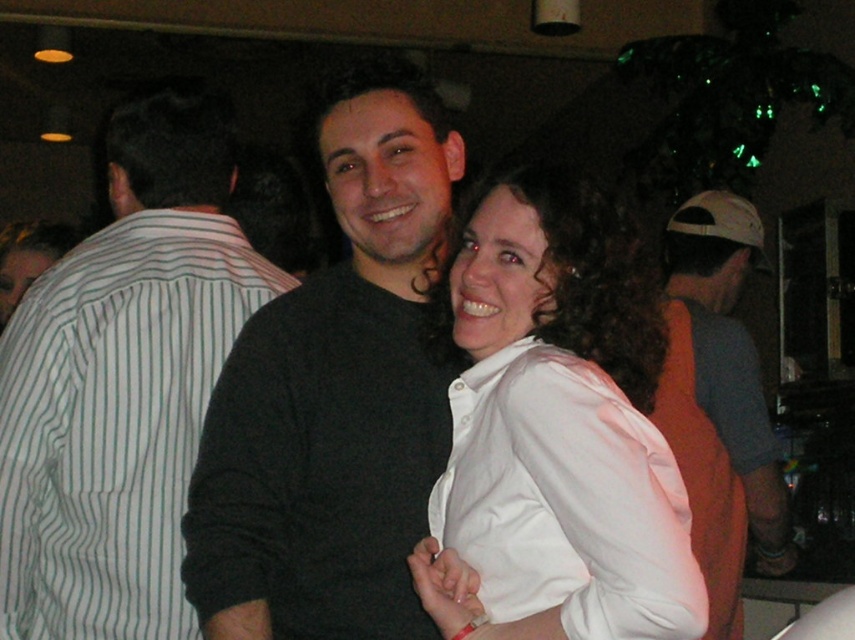
Question: Which point is farther from the camera taking this photo?

Choices:
 (A) (68, 596)
 (B) (735, 627)
 (C) (209, 524)
 (D) (655, 518)

Answer: (B)

Question: Does black matte sweater at center have a greater width compared to gray cotton shirt at right?

Choices:
 (A) yes
 (B) no

Answer: (B)

Question: Which is farther from the white satin blouse at center?

Choices:
 (A) gray cotton shirt at right
 (B) black matte sweater at center

Answer: (A)

Question: Is the position of white striped shirt at left more distant than that of white satin blouse at center?

Choices:
 (A) yes
 (B) no

Answer: (A)

Question: Based on their relative distances, which object is nearer to the black matte sweater at center?

Choices:
 (A) white satin blouse at center
 (B) white striped shirt at left

Answer: (A)

Question: Does black matte sweater at center appear under white satin blouse at center?

Choices:
 (A) no
 (B) yes

Answer: (A)